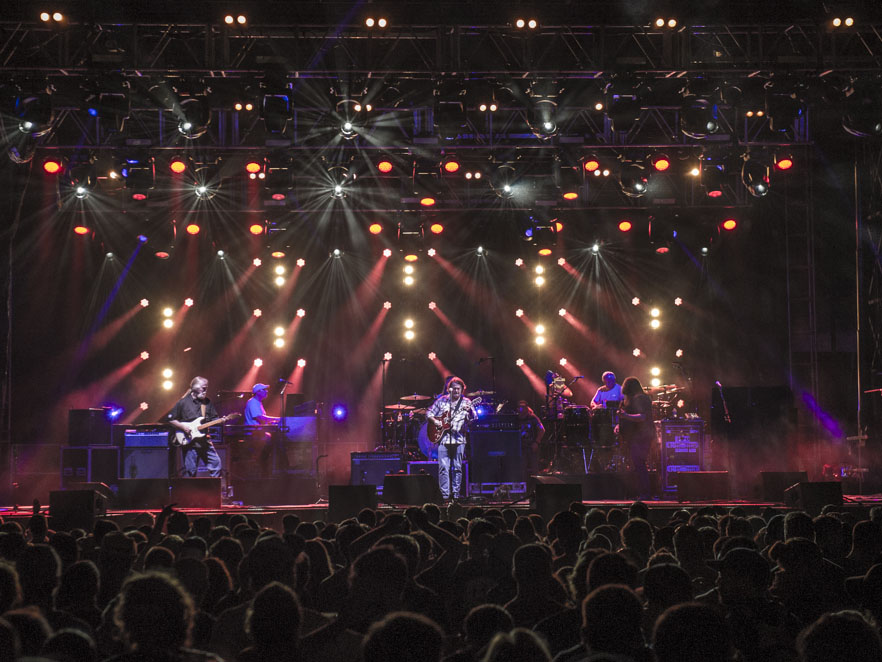
The image size is (882, 662). I want to click on overhead lighting systems, so click(424, 115), click(414, 173), click(413, 214).